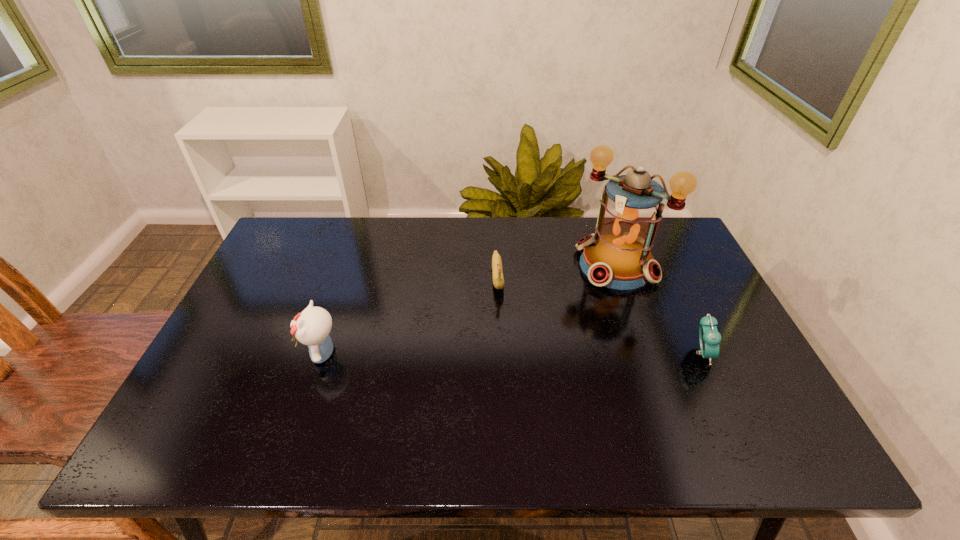
This screenshot has height=540, width=960. In order to click on free spot between the alarm clock and the banana in this screenshot , I will do `click(600, 314)`.

Image resolution: width=960 pixels, height=540 pixels. What are the coordinates of `unoccupied area between the alarm clock and the lantern` in the screenshot? It's located at (659, 309).

This screenshot has width=960, height=540. I want to click on vacant area that lies between the lantern and the alarm clock, so click(x=659, y=309).

Image resolution: width=960 pixels, height=540 pixels. In order to click on vacant space in between the banana and the alarm clock in this screenshot , I will do `click(600, 314)`.

Identify the location of free space between the lantern and the alarm clock. Image resolution: width=960 pixels, height=540 pixels. (659, 309).

I want to click on object that ranks as the second closest to the banana, so click(312, 327).

Identify which object is located as the third nearest to the banana. Please provide its 2D coordinates. Your answer should be formatted as a tuple, i.e. [(x, y)], where the tuple contains the x and y coordinates of a point satisfying the conditions above.

[(710, 338)]

Where is `vacant space that satisfies the following two spatial constraints: 1. on the back side of the banana; 2. on the left side of the lantern`? vacant space that satisfies the following two spatial constraints: 1. on the back side of the banana; 2. on the left side of the lantern is located at coordinates (497, 266).

I want to click on vacant region that satisfies the following two spatial constraints: 1. on the back side of the tallest object; 2. on the right side of the third object from right to left, so click(497, 266).